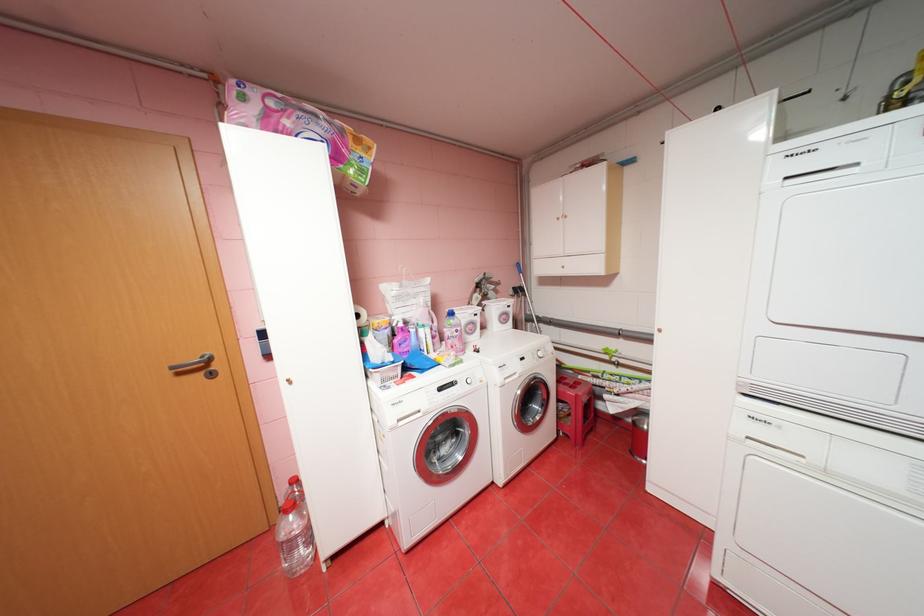
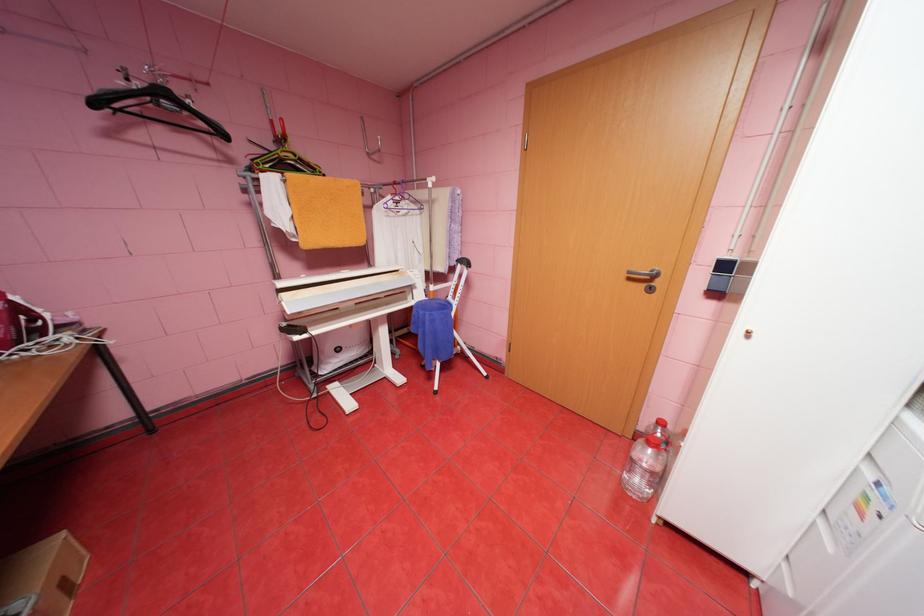
The point at [299,517] is marked in the first image. Where is the corresponding point in the second image?

(659, 451)